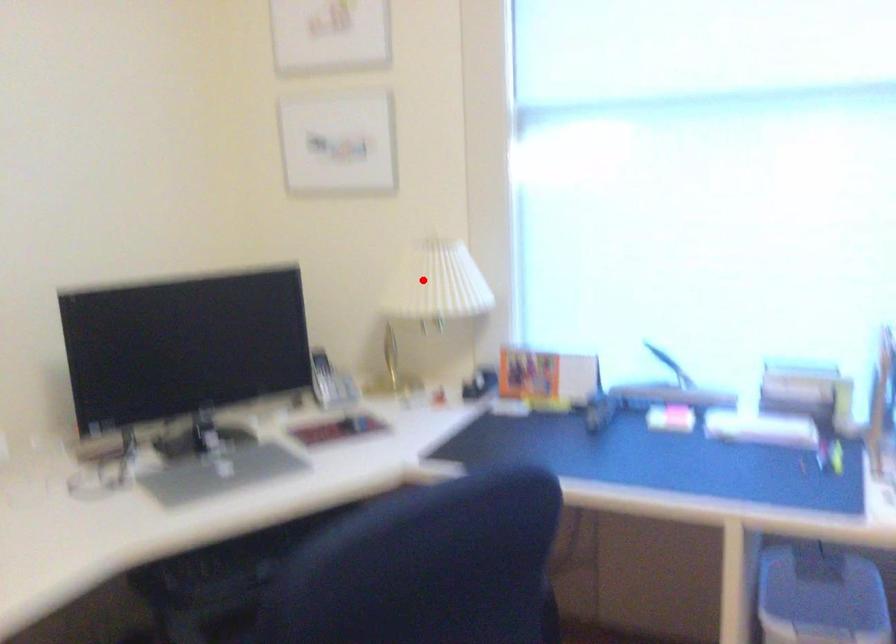
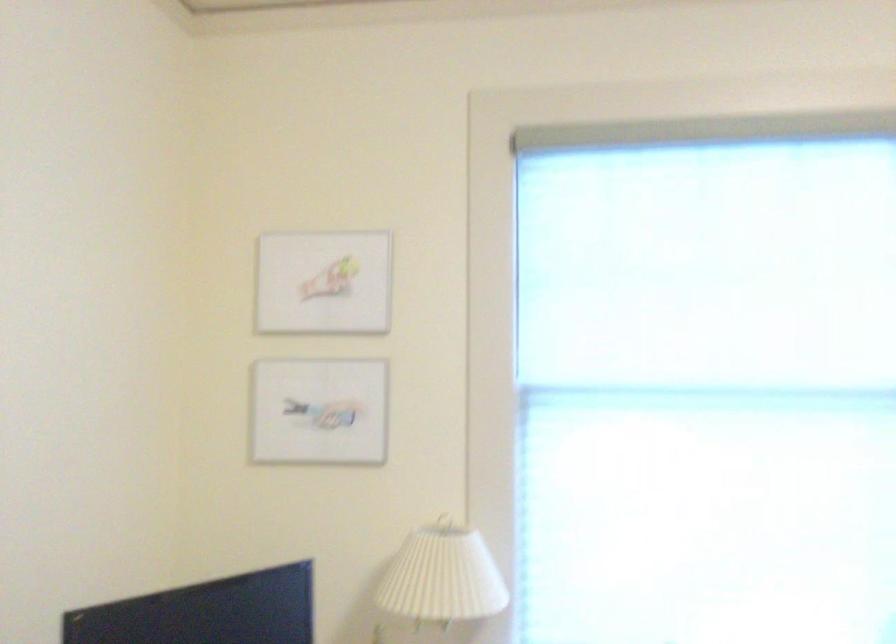
Where in the second image is the point corresponding to the highlighted location from the first image?

(443, 576)